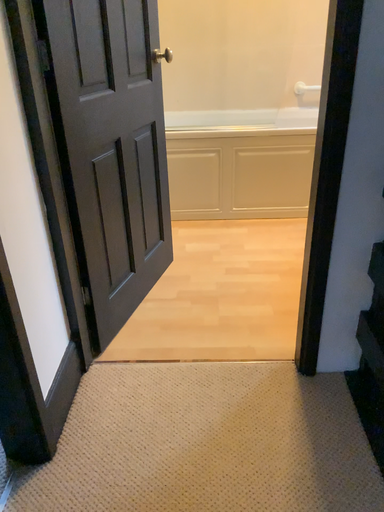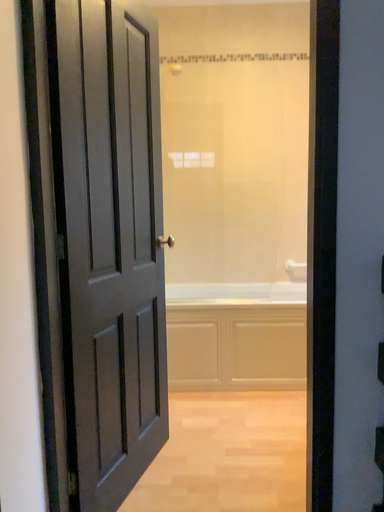
Question: Which way did the camera rotate in the video?

Choices:
 (A) rotated upward
 (B) rotated downward

Answer: (A)